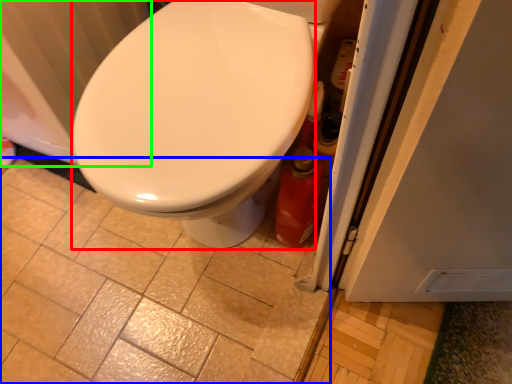
Question: Based on their relative distances, which object is nearer to bidet (highlighted by a red box)? Choose from ceramic tile (highlighted by a blue box) and radiator (highlighted by a green box).

Choices:
 (A) ceramic tile
 (B) radiator

Answer: (B)